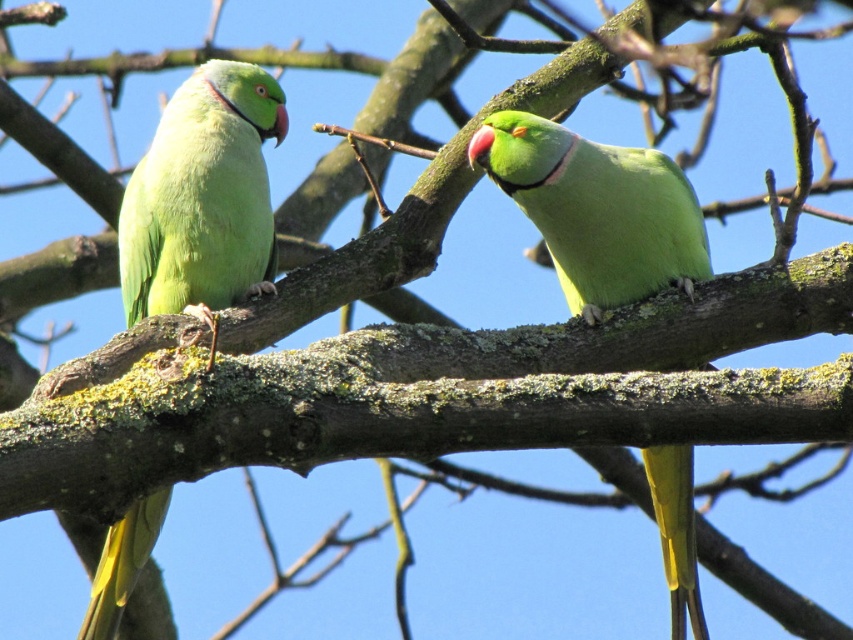
You are a birdwatcher observing two parrots on a branch. You see the matte green parrot at left and the green matte parrot at center. Which parrot is positioned closer to you?

The matte green parrot at left is closer to the viewer than the green matte parrot at center.

Looking at this image, you are a birdwatcher observing two parrots on a branch. You notice the matte green parrot at left and the green matte parrot at center. Which parrot is taller?

The matte green parrot at left is taller than the green matte parrot at center.